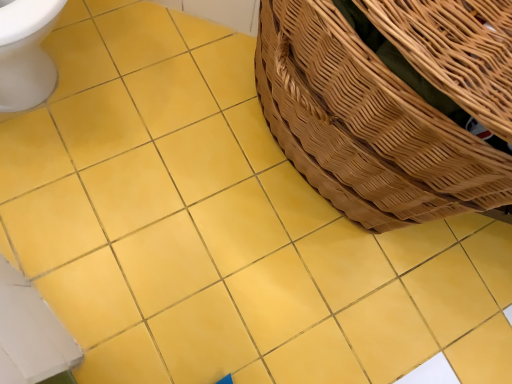
Where is `free location to the right of brown woven picnic basket at right`? This screenshot has width=512, height=384. free location to the right of brown woven picnic basket at right is located at coordinates (442, 290).